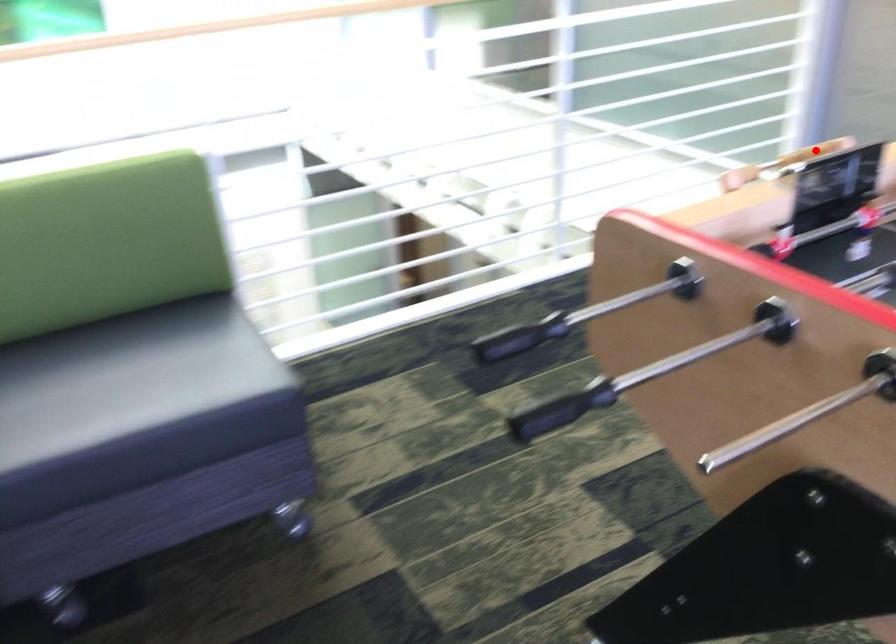
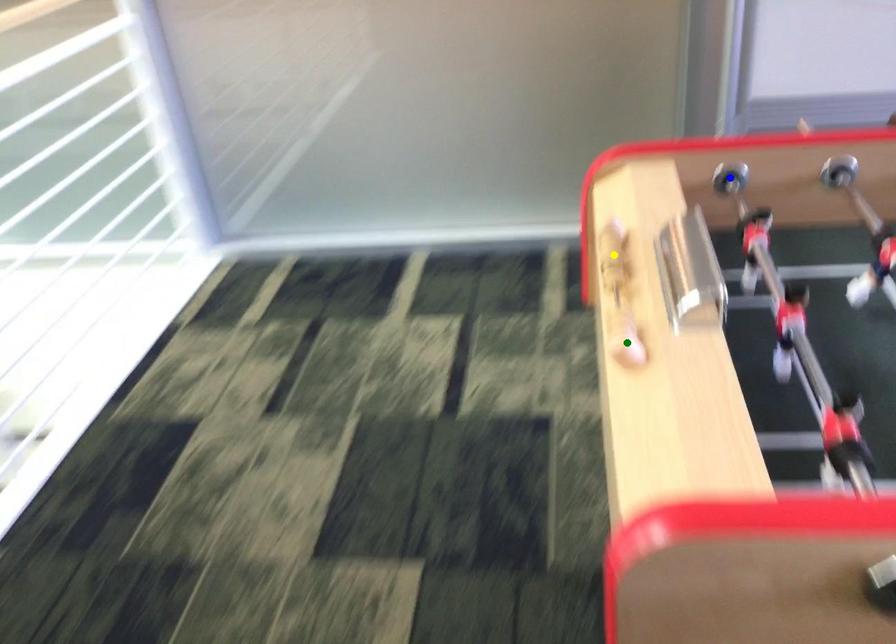
Question: I am providing you with two images of the same scene from different viewpoints. A red point is marked on the first image. You are given multiple points on the second image. In image 2, which mark is for the same physical point as the one in image 1?

Choices:
 (A) yellow point
 (B) blue point
 (C) green point

Answer: (A)